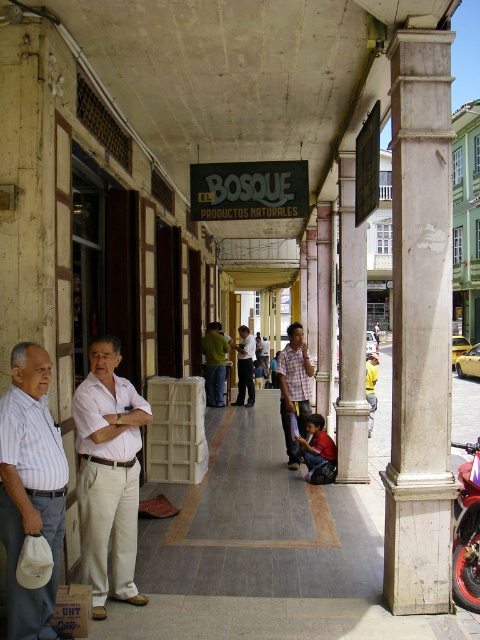
You are a delivery person standing at the entrance of the covered walkway. You need to place a package on the striped cotton shirt at center and the light brown leather shirt at center. However, your delivery cart is 10 meters long. Can you fit both items on the cart without moving them closer together?

The striped cotton shirt at center is 10.25 meters from the light brown leather shirt at center. Since the distance between them is greater than the cart length of 10 meters, you cannot fit both items on the cart without moving them closer together.

You are a customer in this market and see both the striped cotton shirt at center and the plaid cotton shirt at center hanging on a clothesline. Which shirt is positioned more to the left side?

The striped cotton shirt at center is positioned more to the left side than the plaid cotton shirt at center.

You are a delivery person carrying a large package and need to walk through the covered walkway. There is a striped cotton shirt at center and a white marble pillar at center in your path. Can you walk between them without moving either object?

The striped cotton shirt at center is in front of the white marble pillar at center, so there is no space between them for you to walk through. You would need to move one of the objects to create a path.